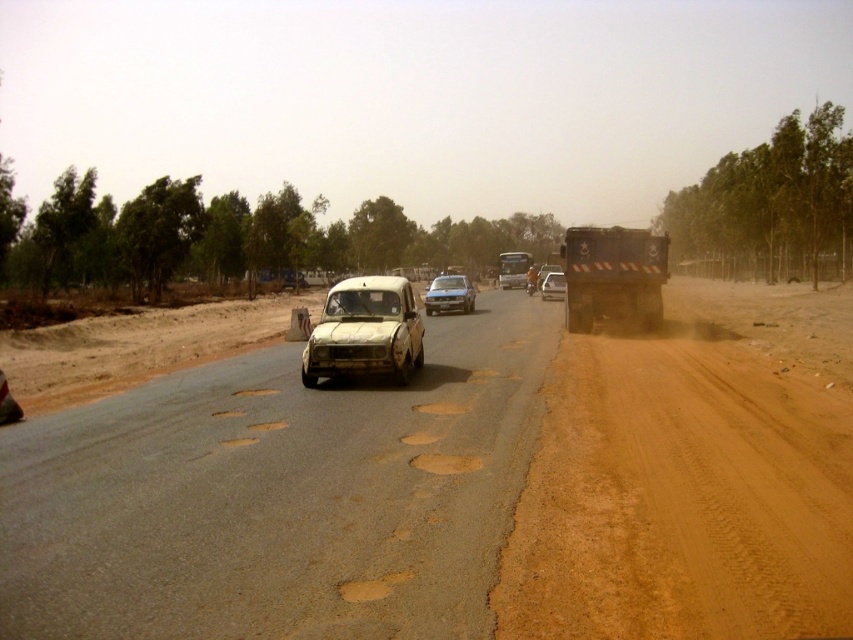
Can you confirm if white matte car at center is positioned above metallic silver truck at right?

Correct, white matte car at center is located above metallic silver truck at right.

Is white matte car at center bigger than metallic silver truck at right?

Yes, white matte car at center is bigger than metallic silver truck at right.

Between point (430, 307) and point (564, 285), which one is positioned in front?

Point (430, 307) is in front.

I want to click on white matte car at center, so click(450, 294).

Does metallic gray truck at right have a greater height compared to metallic silver bus at center?

No.

Is point (614, 250) in front of point (498, 268)?

Yes, point (614, 250) is in front of point (498, 268).

You are a GUI agent. You are given a task and a screenshot of the screen. Output one action in this format:
    pyautogui.click(x=<x>, y=<y>)
    Task: Click on the metallic gray truck at right
    The width and height of the screenshot is (853, 640).
    Given the screenshot: What is the action you would take?
    pyautogui.click(x=613, y=275)

Where is `metallic gray truck at right`? metallic gray truck at right is located at coordinates (613, 275).

Does metallic gray truck at right come in front of metallic silver truck at right?

Yes, it is in front of metallic silver truck at right.

Between point (631, 310) and point (552, 292), which one is positioned behind?

Point (552, 292)

In order to click on metallic gray truck at right in this screenshot , I will do `click(613, 275)`.